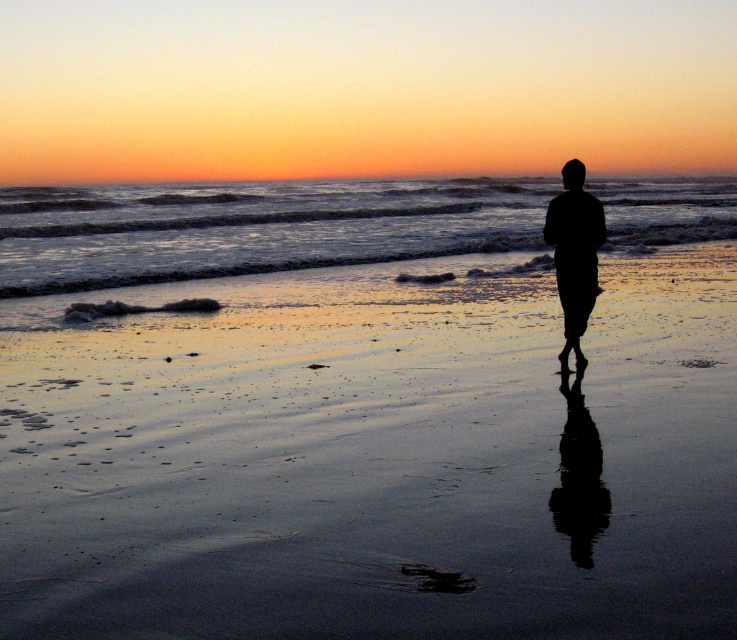
Which is behind, point (91, 602) or point (85, 243)?

The point (85, 243) is behind.

Is shiny sand at center bigger than clear water at center?

Actually, shiny sand at center might be smaller than clear water at center.

Image resolution: width=737 pixels, height=640 pixels. Identify the location of shiny sand at center. (380, 465).

What are the coordinates of `shiny sand at center` in the screenshot? It's located at tap(380, 465).

Based on the photo, does shiny sand at center appear over black matte figure at center?

Actually, shiny sand at center is below black matte figure at center.

You are a GUI agent. You are given a task and a screenshot of the screen. Output one action in this format:
    pyautogui.click(x=<x>, y=<y>)
    Task: Click on the shiny sand at center
    This screenshot has width=737, height=640.
    Given the screenshot: What is the action you would take?
    pyautogui.click(x=380, y=465)

Locate an element on the screen. shiny sand at center is located at coordinates (380, 465).

Between clear water at center and black matte figure at center, which one appears on the left side from the viewer's perspective?

From the viewer's perspective, clear water at center appears more on the left side.

Who is lower down, clear water at center or black matte figure at center?

black matte figure at center is below.

This screenshot has width=737, height=640. What are the coordinates of `clear water at center` in the screenshot? It's located at pyautogui.click(x=254, y=227).

Find the location of a particular element. clear water at center is located at coordinates (254, 227).